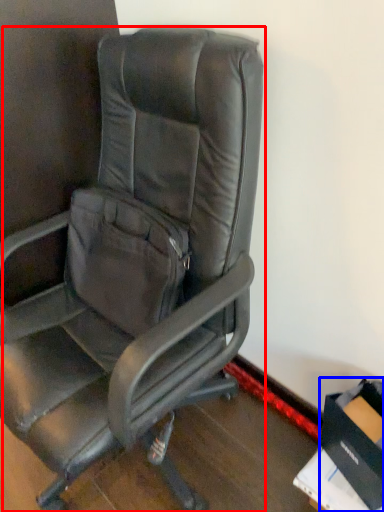
Question: Which of the following is the closest to the observer, chair (highlighted by a red box) or cardboard box (highlighted by a blue box)?

Choices:
 (A) chair
 (B) cardboard box

Answer: (A)